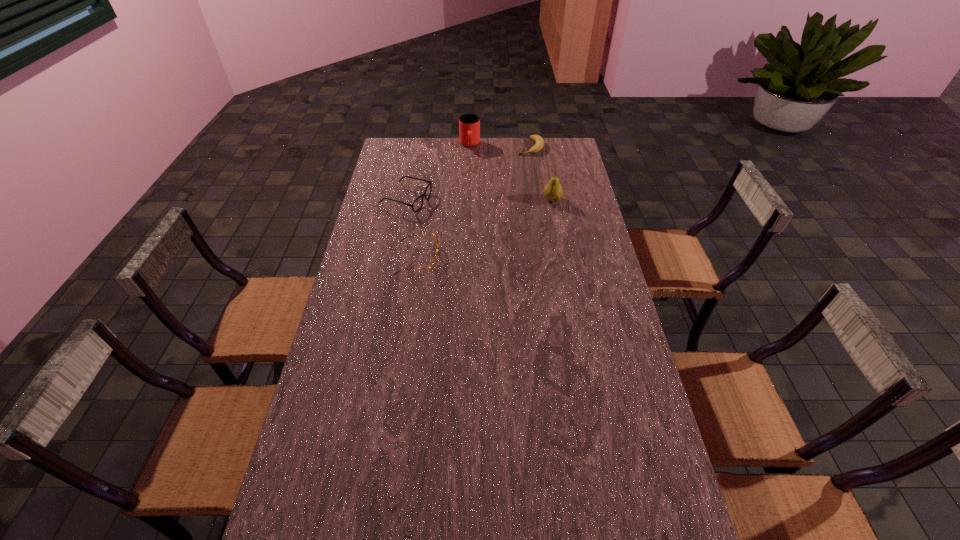
Find the location of a particular element. This screenshot has height=540, width=960. object that is at the far right corner is located at coordinates (538, 146).

Where is `vacant space at the far edge of the desktop`? vacant space at the far edge of the desktop is located at coordinates (473, 147).

Locate an element on the screen. vacant region at the near edge of the desktop is located at coordinates click(x=362, y=525).

This screenshot has height=540, width=960. I want to click on vacant space at the left edge of the desktop, so click(x=377, y=191).

The height and width of the screenshot is (540, 960). In order to click on free point at the right edge in this screenshot , I will do `click(591, 237)`.

Where is `vacant position at the near left corner of the desktop`? This screenshot has width=960, height=540. vacant position at the near left corner of the desktop is located at coordinates (312, 504).

This screenshot has height=540, width=960. In the image, there is a desktop. In order to click on blank space at the far right corner in this screenshot , I will do point(562,163).

This screenshot has width=960, height=540. Identify the location of vacant area that lies between the farther spectacles and the pear. (479, 200).

Where is `empty space between the third object from right to left and the nearest object`? The height and width of the screenshot is (540, 960). empty space between the third object from right to left and the nearest object is located at coordinates [444, 202].

Find the location of a particular element. This screenshot has height=540, width=960. empty space that is in between the nearer spectacles and the shortest object is located at coordinates (474, 203).